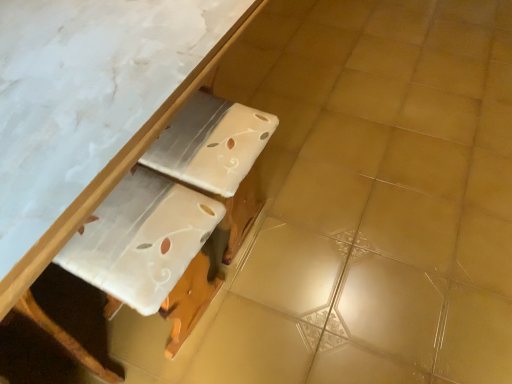
Question: From a real-world perspective, is white glossy table at upper center positioned above or below white glossy cardboard at center?

Choices:
 (A) above
 (B) below

Answer: (A)

Question: From the image's perspective, relative to white glossy cardboard at center, is white glossy table at upper center above or below?

Choices:
 (A) above
 (B) below

Answer: (A)

Question: Is white glossy table at upper center inside the boundaries of white glossy cardboard at center, or outside?

Choices:
 (A) outside
 (B) inside

Answer: (A)

Question: Considering the positions of white glossy cardboard at center and white glossy table at upper center in the image, is white glossy cardboard at center bigger or smaller than white glossy table at upper center?

Choices:
 (A) small
 (B) big

Answer: (A)

Question: Visually, is white glossy cardboard at center positioned to the left or to the right of white glossy table at upper center?

Choices:
 (A) right
 (B) left

Answer: (A)

Question: From the image's perspective, is white glossy cardboard at center above or below white glossy table at upper center?

Choices:
 (A) above
 (B) below

Answer: (B)

Question: Is white glossy cardboard at center wider or thinner than white glossy table at upper center?

Choices:
 (A) wide
 (B) thin

Answer: (B)